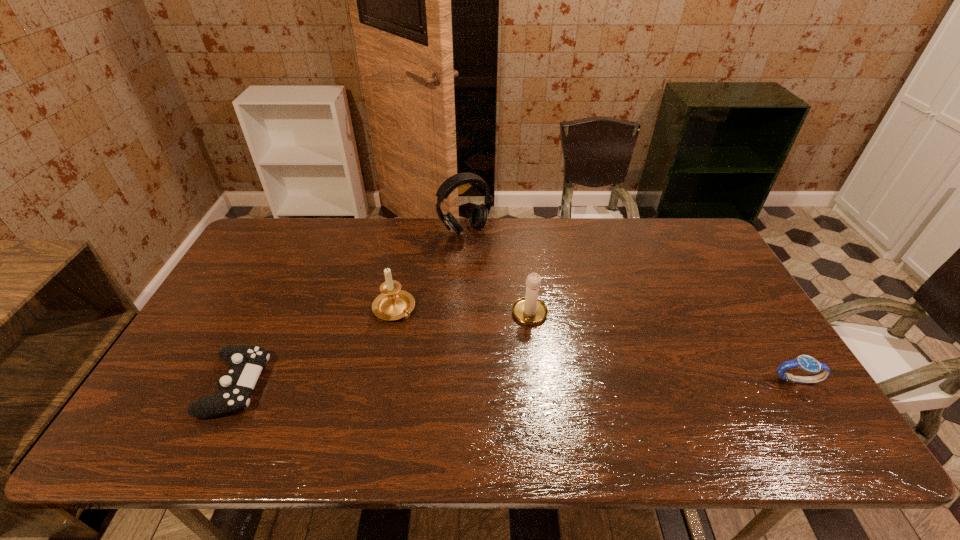
In order to click on the fourth closest object to the control in this screenshot , I will do `click(806, 363)`.